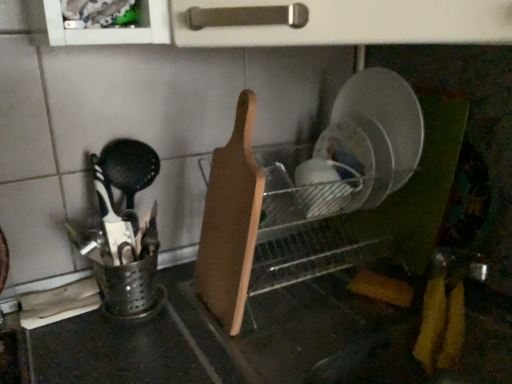
Describe the element at coordinates (231, 222) in the screenshot. I see `wooden cutting board at center` at that location.

Measure the distance between point (220, 280) and camera.

76.00 centimeters.

Where is `wooden cutting board at center`? The image size is (512, 384). wooden cutting board at center is located at coordinates (231, 222).

Measure the distance between point (340, 198) and camera.

34.45 inches.

Where is `matte white bowl at center`? matte white bowl at center is located at coordinates (324, 187).

This screenshot has height=384, width=512. Describe the element at coordinates (324, 187) in the screenshot. I see `matte white bowl at center` at that location.

This screenshot has width=512, height=384. In order to click on wooden cutting board at center in this screenshot , I will do click(x=231, y=222).

Which object is positioned more to the left, wooden cutting board at center or matte white bowl at center?

wooden cutting board at center is more to the left.

Which object is closer to the camera taking this photo, wooden cutting board at center or matte white bowl at center?

wooden cutting board at center is closer to the camera.

Which is nearer, (249, 255) or (308, 215)?

Clearly, point (249, 255) is closer to the camera than point (308, 215).

From the image's perspective, is wooden cutting board at center above or below matte white bowl at center?

From the image's perspective, wooden cutting board at center appears below matte white bowl at center.

From a real-world perspective, who is located higher, wooden cutting board at center or matte white bowl at center?

wooden cutting board at center is physically above.

Looking at this image, between wooden cutting board at center and matte white bowl at center, which one has larger width?

wooden cutting board at center.

Considering the sizes of objects wooden cutting board at center and matte white bowl at center in the image provided, who is taller, wooden cutting board at center or matte white bowl at center?

Standing taller between the two is wooden cutting board at center.

In terms of size, does wooden cutting board at center appear bigger or smaller than matte white bowl at center?

In the image, wooden cutting board at center appears to be larger than matte white bowl at center.

Could matte white bowl at center be considered to be inside wooden cutting board at center?

No, matte white bowl at center is not a part of wooden cutting board at center.

Is wooden cutting board at center positioned far away from matte white bowl at center?

No, wooden cutting board at center is not far away from matte white bowl at center.

Consider the image. Could you tell me if wooden cutting board at center is facing matte white bowl at center?

Yes, wooden cutting board at center is aimed at matte white bowl at center.

From the picture: How many degrees apart are the facing directions of wooden cutting board at center and matte white bowl at center?

90 degrees.

Find the location of `cutting board in front of the matte white bowl at center`. cutting board in front of the matte white bowl at center is located at coordinates (231, 222).

Considering the positions of objects matte white bowl at center and wooden cutting board at center in the image provided, who is more to the right, matte white bowl at center or wooden cutting board at center?

From the viewer's perspective, matte white bowl at center appears more on the right side.

Is matte white bowl at center further to the viewer compared to wooden cutting board at center?

Yes, it is.

Is point (353, 177) less distant than point (240, 305)?

No, it is not.

From the image's perspective, would you say matte white bowl at center is shown under wooden cutting board at center?

Incorrect, from the image's perspective, matte white bowl at center is higher than wooden cutting board at center.

From a real-world perspective, which is physically above, matte white bowl at center or wooden cutting board at center?

wooden cutting board at center.

Is matte white bowl at center wider than wooden cutting board at center?

No, matte white bowl at center is not wider than wooden cutting board at center.

Is matte white bowl at center taller or shorter than wooden cutting board at center?

Considering their sizes, matte white bowl at center has less height than wooden cutting board at center.

Between matte white bowl at center and wooden cutting board at center, which one has larger size?

With larger size is wooden cutting board at center.

Do you think matte white bowl at center is within wooden cutting board at center, or outside of it?

matte white bowl at center is spatially situated outside wooden cutting board at center.

Would you say matte white bowl at center is a long distance from wooden cutting board at center?

matte white bowl at center is actually quite close to wooden cutting board at center.

Is wooden cutting board at center at the back of matte white bowl at center?

No, matte white bowl at center is not facing away from wooden cutting board at center.

Can you tell me how much matte white bowl at center and wooden cutting board at center differ in facing direction?

The angle between the facing direction of matte white bowl at center and the facing direction of wooden cutting board at center is 90 degrees.

The image size is (512, 384). I want to click on tableware behind the wooden cutting board at center, so click(324, 187).

I want to click on tableware lying behind the wooden cutting board at center, so click(x=324, y=187).

Where is `tableware that appears below the wooden cutting board at center (from a real-world perspective)`? The image size is (512, 384). tableware that appears below the wooden cutting board at center (from a real-world perspective) is located at coordinates (324, 187).